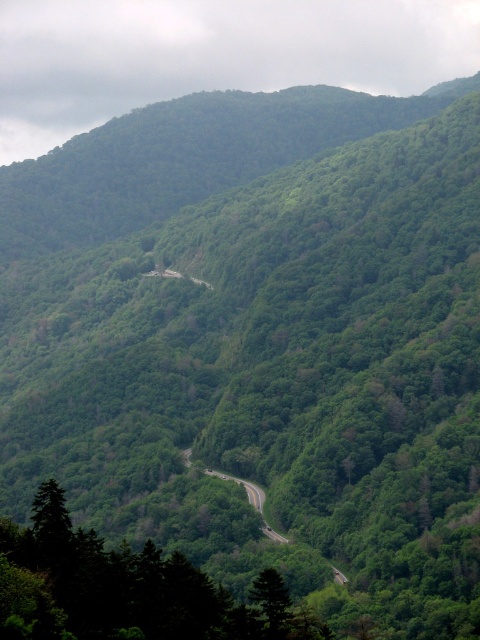
Question: Which point is farther from the camera taking this photo?

Choices:
 (A) (276, 540)
 (B) (115, 584)

Answer: (A)

Question: From the image, what is the correct spatial relationship of green leafy tree at lower left in relation to green asphalt road at center?

Choices:
 (A) below
 (B) above

Answer: (B)

Question: Can you confirm if green leafy tree at lower left is wider than green asphalt road at center?

Choices:
 (A) yes
 (B) no

Answer: (B)

Question: Which object appears closest to the camera in this image?

Choices:
 (A) green leafy tree at lower left
 (B) green asphalt road at center

Answer: (A)

Question: Does green leafy tree at lower left appear over green asphalt road at center?

Choices:
 (A) no
 (B) yes

Answer: (B)

Question: Which point is closer to the camera?

Choices:
 (A) green leafy tree at lower left
 (B) green asphalt road at center

Answer: (A)